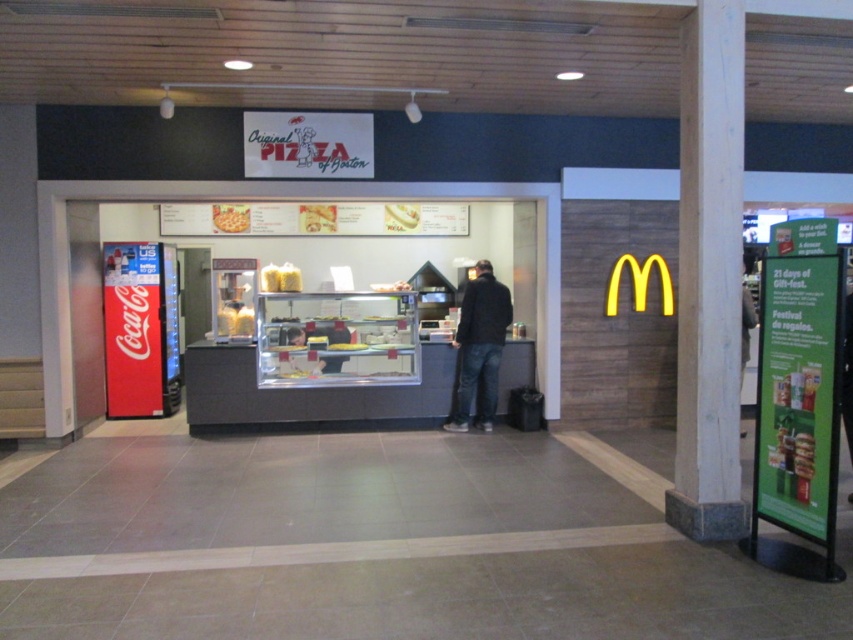
The image size is (853, 640). I want to click on matte yellow cheese at center, so click(317, 218).

What do you see at coordinates (317, 218) in the screenshot? I see `matte yellow cheese at center` at bounding box center [317, 218].

The width and height of the screenshot is (853, 640). What are the coordinates of `matte yellow cheese at center` in the screenshot? It's located at (317, 218).

Is dark blue jeans at center shorter than golden crispy pizza at center?

In fact, dark blue jeans at center may be taller than golden crispy pizza at center.

Find the location of `dark blue jeans at center`. dark blue jeans at center is located at coordinates (479, 348).

Is dark blue jeans at center bigger than matte yellow cheese at center?

Correct, dark blue jeans at center is larger in size than matte yellow cheese at center.

Consider the image. Between dark blue jeans at center and matte yellow cheese at center, which one appears on the left side from the viewer's perspective?

matte yellow cheese at center

Between point (480, 413) and point (305, 209), which one is positioned behind?

The point (305, 209) is more distant.

Where is `dark blue jeans at center`? dark blue jeans at center is located at coordinates (479, 348).